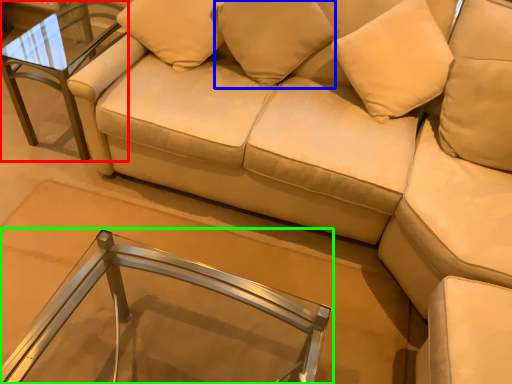
Question: Estimate the real-world distances between objects in this image. Which object is farther from table (highlighted by a red box), pillow (highlighted by a blue box) or table (highlighted by a green box)?

Choices:
 (A) pillow
 (B) table

Answer: (B)